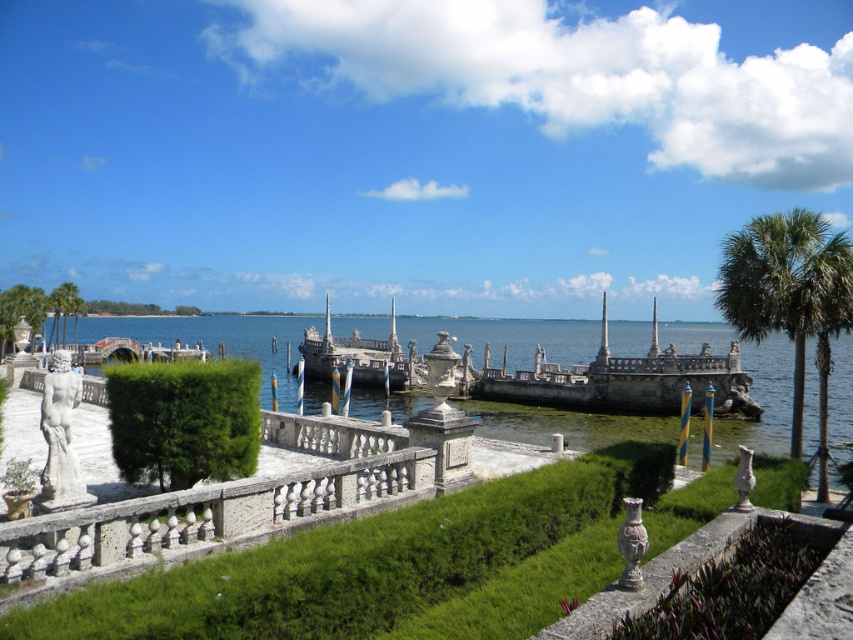
Can you confirm if green stone hedge at center is bigger than stone boat at center?

No, green stone hedge at center is not bigger than stone boat at center.

Which is in front, point (692, 632) or point (395, 362)?

Point (692, 632) is in front.

The height and width of the screenshot is (640, 853). I want to click on green stone hedge at center, so click(734, 586).

Find the location of a particular element. The height and width of the screenshot is (640, 853). green leafy hedge at center is located at coordinates (184, 420).

Which is in front, point (125, 374) or point (740, 541)?

Point (740, 541) is in front.

The height and width of the screenshot is (640, 853). Identify the location of green leafy hedge at center. (184, 420).

Between clear blue water at center and stone boat at center, which one appears on the right side from the viewer's perspective?

clear blue water at center

Does point (595, 344) come in front of point (407, 358)?

No.

What do you see at coordinates (218, 339) in the screenshot? The width and height of the screenshot is (853, 640). I see `clear blue water at center` at bounding box center [218, 339].

Locate an element on the screen. The image size is (853, 640). clear blue water at center is located at coordinates (218, 339).